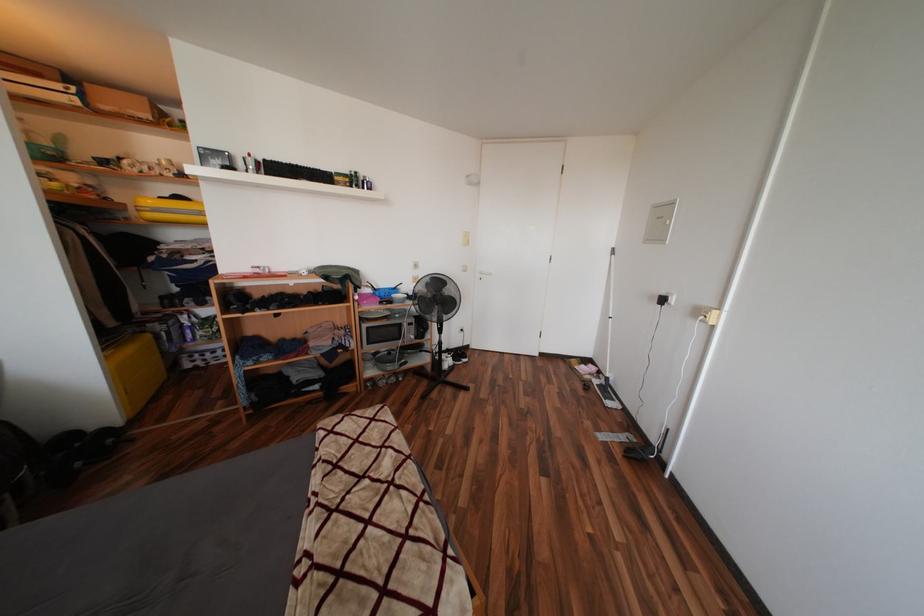
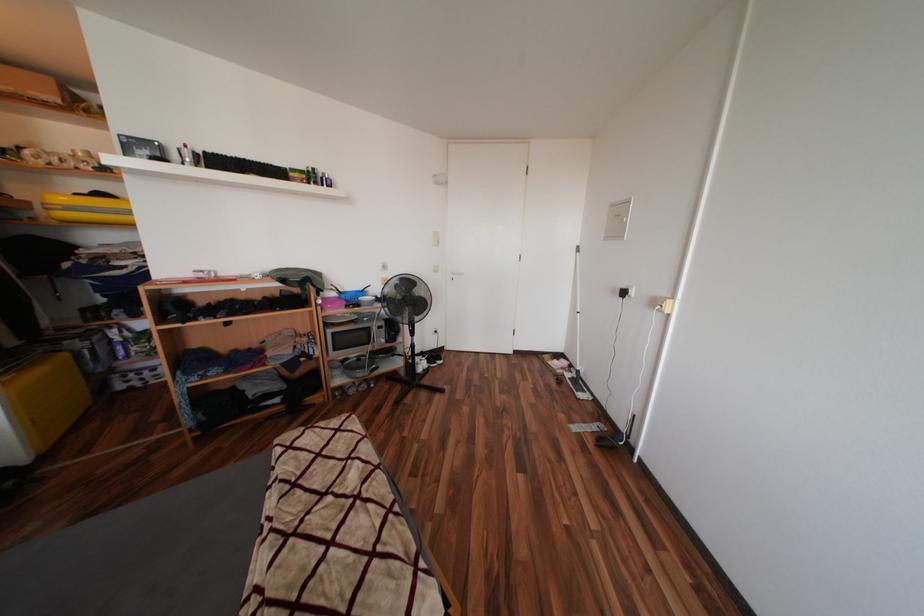
Which direction would the cameraman need to move to produce the second image?

The cameraman moved toward right, forward.